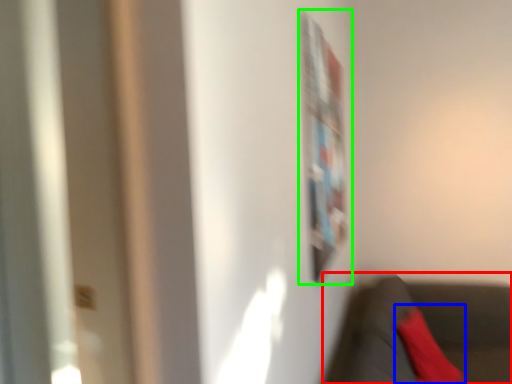
Question: Based on their relative distances, which object is farther from chair (highlighted by a red box)? Choose from pillow (highlighted by a blue box) and bulletin board (highlighted by a green box).

Choices:
 (A) pillow
 (B) bulletin board

Answer: (B)